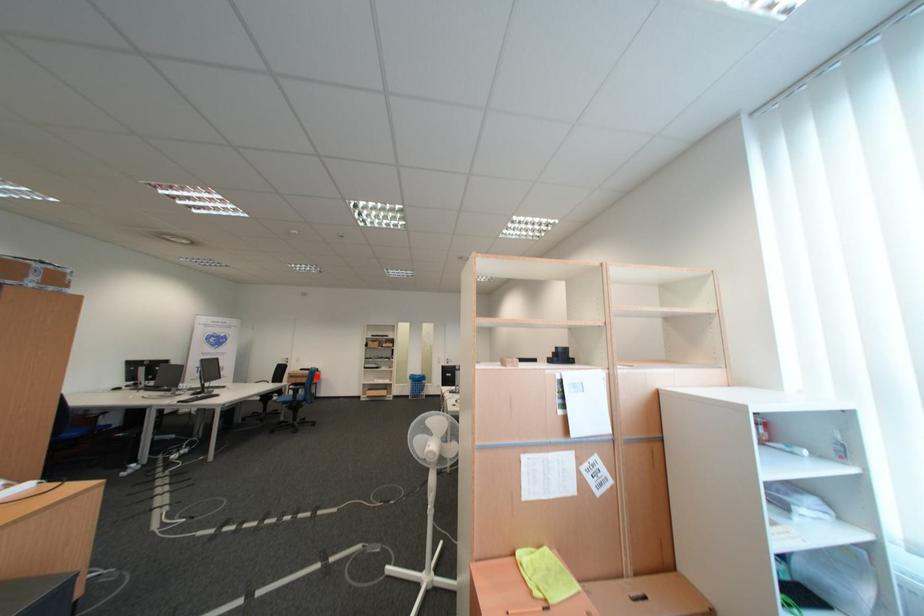
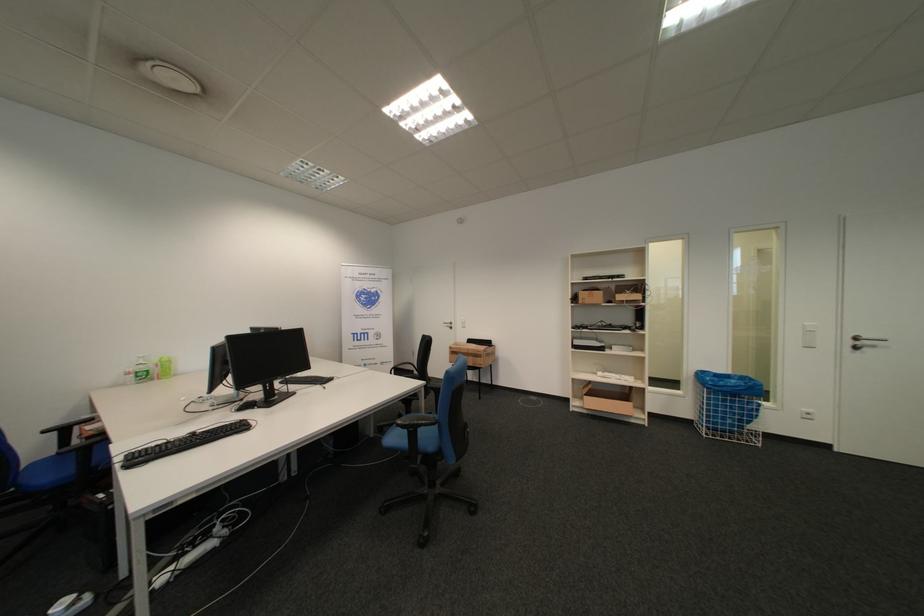
Question: I am providing you with two images of the same scene from different viewpoints. Image1 has a red point marked. In image2, the corresponding 3D location appears at what relative position? Reply with the corresponding letter.

Choices:
 (A) Closer
 (B) Farther

Answer: (B)